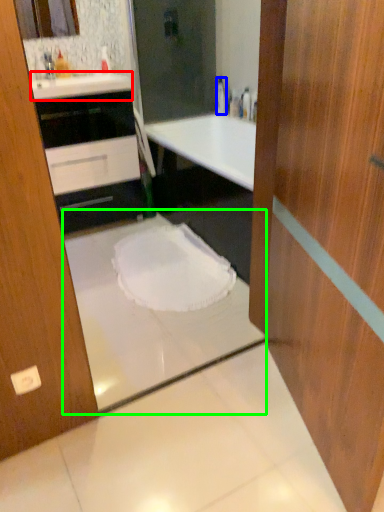
Question: Considering the real-world distances, which object is closest to counter top (highlighted by a red box)? bottle (highlighted by a blue box) or bath (highlighted by a green box).

Choices:
 (A) bottle
 (B) bath

Answer: (B)